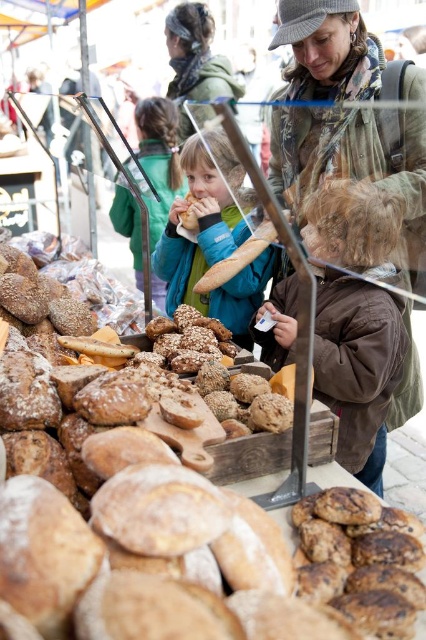
You are standing in the market scene and notice the blue denim jacket at center. If you want to locate it precisely on a coordinate grid where the bottom left corner is the origin, what are its coordinates?

The blue denim jacket at center is located at coordinates approximately 0.392 on the x axis and 0.493 on the y axis.